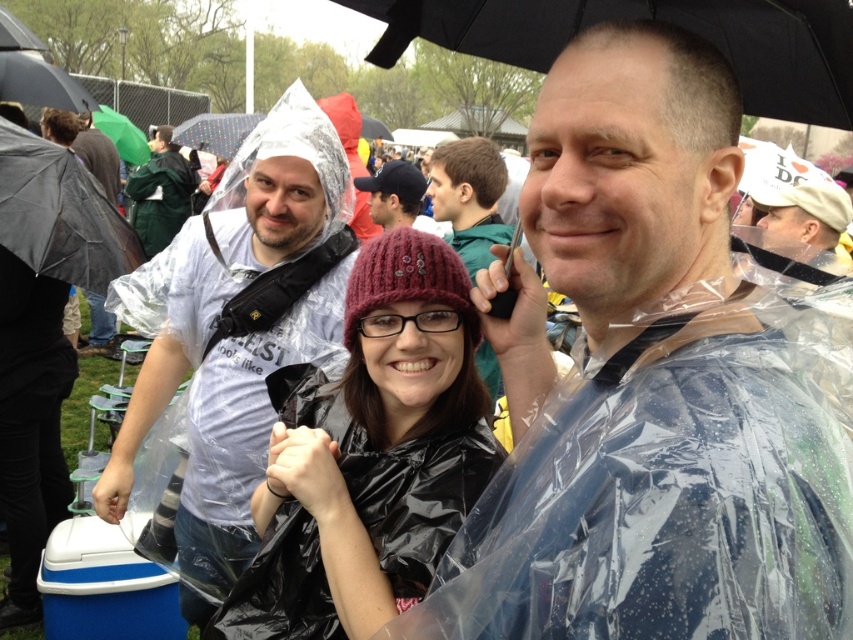
Question: Can you confirm if white fabric hat at upper right is positioned to the left of matte black jacket at center?

Choices:
 (A) yes
 (B) no

Answer: (B)

Question: Which object is positioned farthest from the transparent plastic poncho at left?

Choices:
 (A) matte black jacket at center
 (B) black matte umbrella at left
 (C) maroon knit hat at center

Answer: (A)

Question: Which of the following is the closest to the observer?

Choices:
 (A) (838, 214)
 (B) (288, 112)
 (C) (225, 125)

Answer: (B)

Question: Which of the following is the closest to the observer?

Choices:
 (A) dark gray knit cap at center
 (B) black matte umbrella at upper center
 (C) green plastic poncho at center

Answer: (B)

Question: Does maroon knit hat at center appear over dark gray knit cap at center?

Choices:
 (A) no
 (B) yes

Answer: (A)

Question: Is transparent plastic poncho at left in front of white fabric hat at upper right?

Choices:
 (A) yes
 (B) no

Answer: (B)